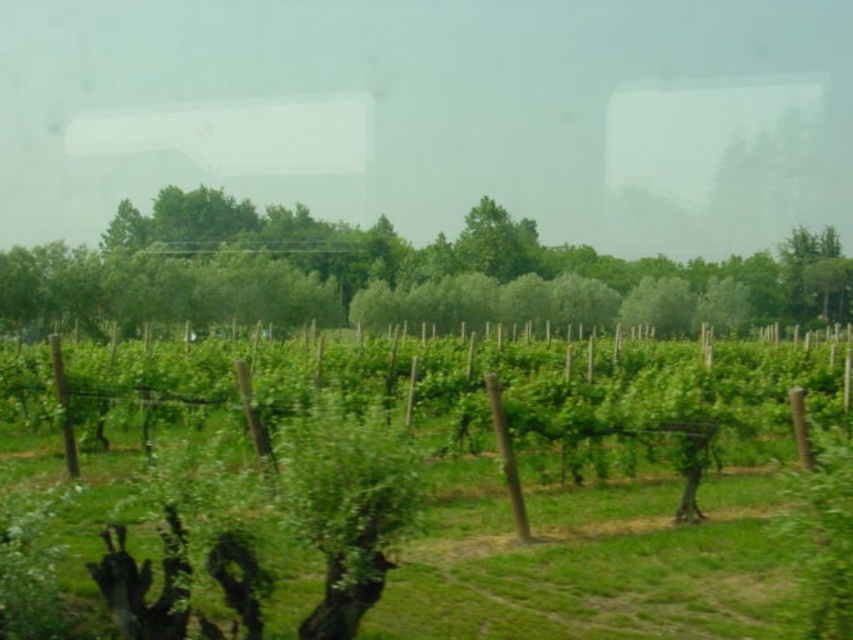
Is green leafy vines at center bigger than green leafy tree at center?

Actually, green leafy vines at center might be smaller than green leafy tree at center.

From the picture: Between green leafy vines at center and green leafy tree at center, which one has less height?

green leafy vines at center is shorter.

Locate an element on the screen. This screenshot has height=640, width=853. green leafy vines at center is located at coordinates (474, 506).